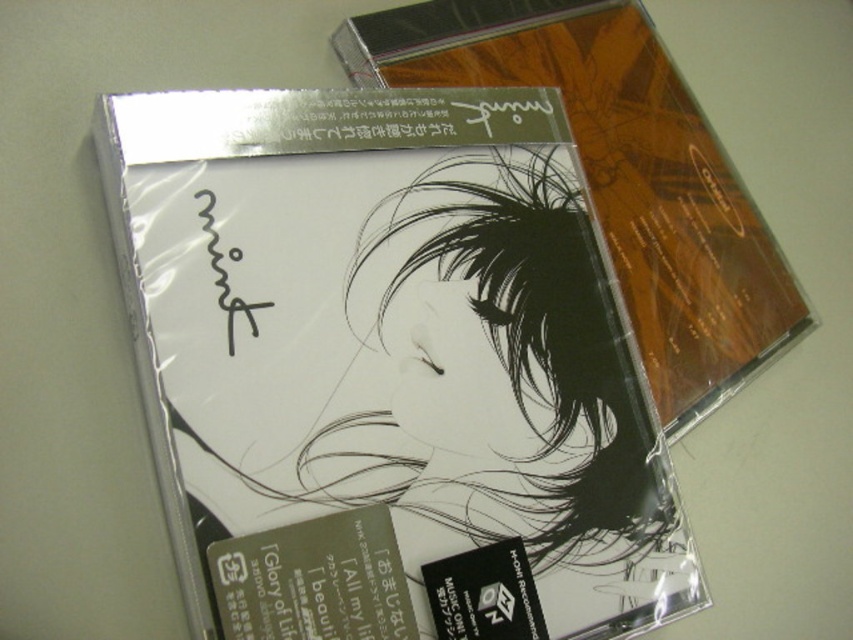
Can you confirm if white paper at center is shorter than matte plastic cd case at center?

Incorrect, white paper at center's height does not fall short of matte plastic cd case at center's.

Does white paper at center lie behind matte plastic cd case at center?

No, it is not.

The image size is (853, 640). Describe the element at coordinates (386, 362) in the screenshot. I see `white paper at center` at that location.

Find the location of a particular element. white paper at center is located at coordinates (386, 362).